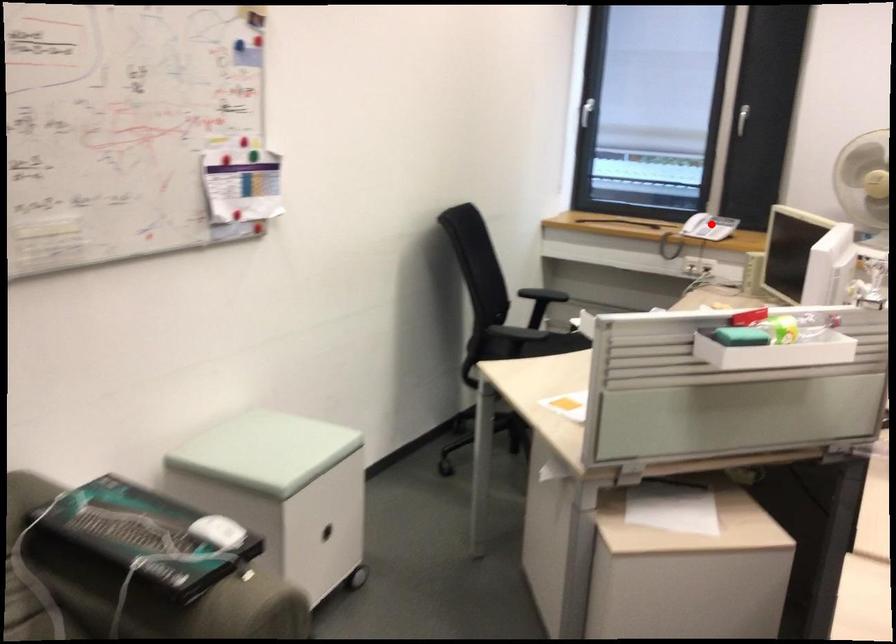
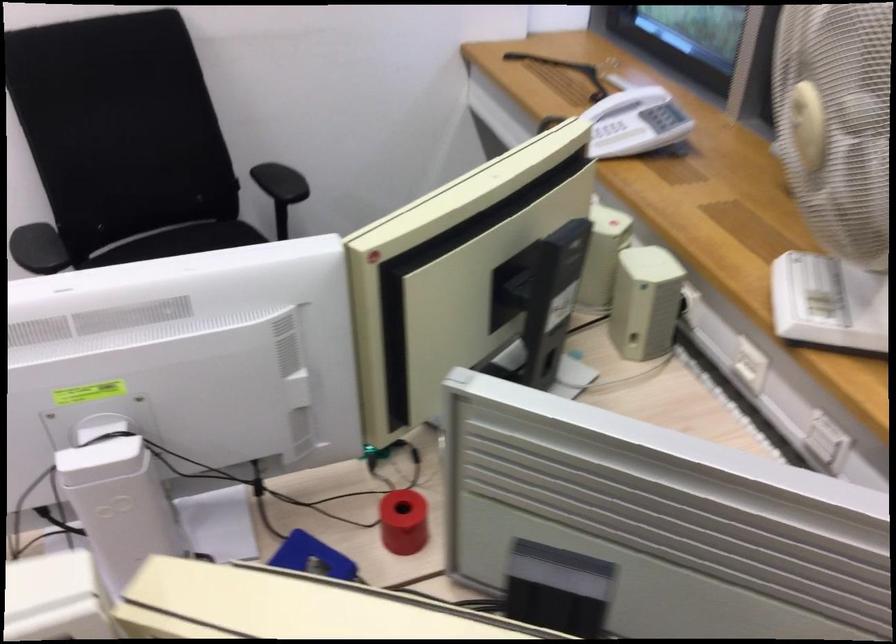
Question: I am providing you with two images of the same scene from different viewpoints. Given a red point in image1, look at the same physical point in image2. Is it:

Choices:
 (A) Closer to the viewpoint
 (B) Farther from the viewpoint

Answer: (A)